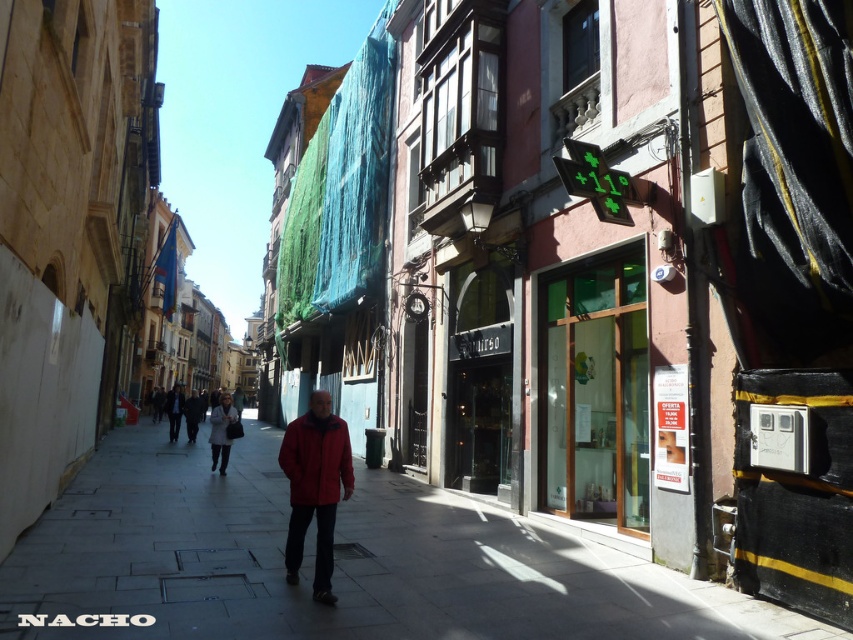
You are a fashion designer observing the street scene. You notice two jackets worn by pedestrians at the center of the image. Which jacket, the red matte jacket at center or the dark gray jacket at center, would you recommend for colder weather?

The dark gray jacket at center is thicker than the red matte jacket at center, so it would be more suitable for colder weather.

You are a photographer trying to capture a photo of the street scene. You notice the red matte jacket at center and the dark gray suit at center in your frame. Which of these two objects takes up less space in the photo?

The red matte jacket at center occupies less space than the dark gray suit at center in the photo.

You are standing at the camera position and want to find the red matte jacket at center. According to the coordinates, where would you look on the image to locate it?

The red matte jacket at center is located at the 2D coordinates point (315,486).